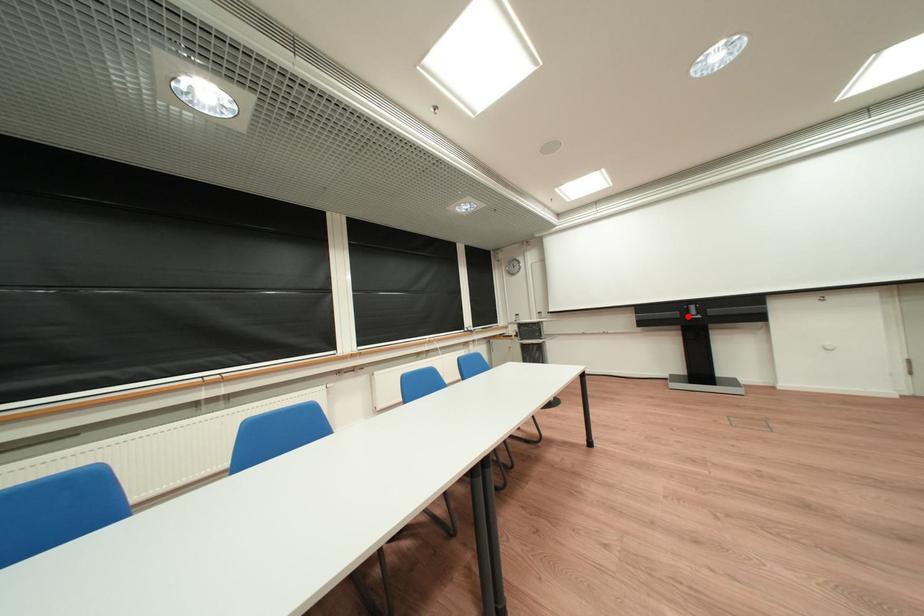
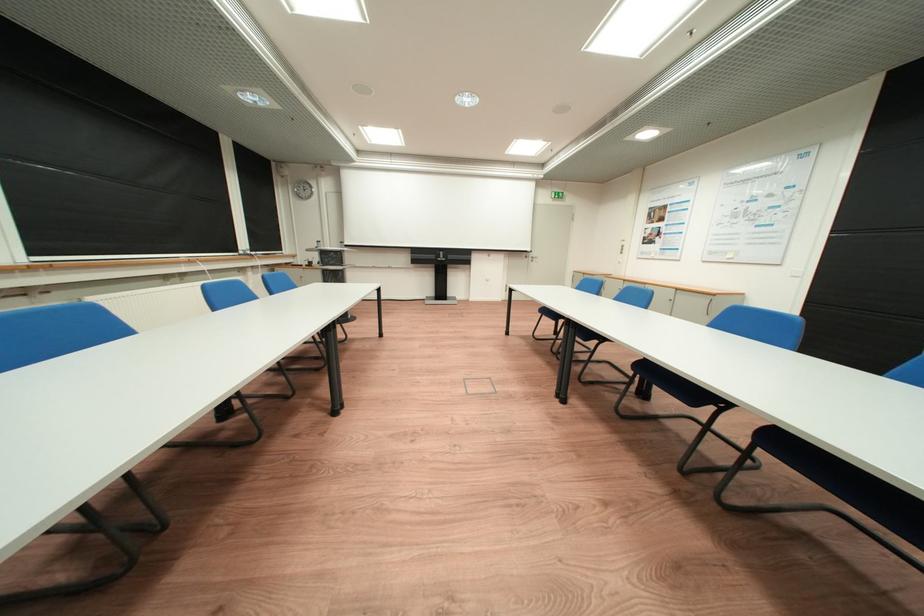
Question: I am providing you with two images of the same scene from different viewpoints. Given a red point in image1, look at the same physical point in image2. Is it:

Choices:
 (A) Closer to the viewpoint
 (B) Farther from the viewpoint

Answer: (A)